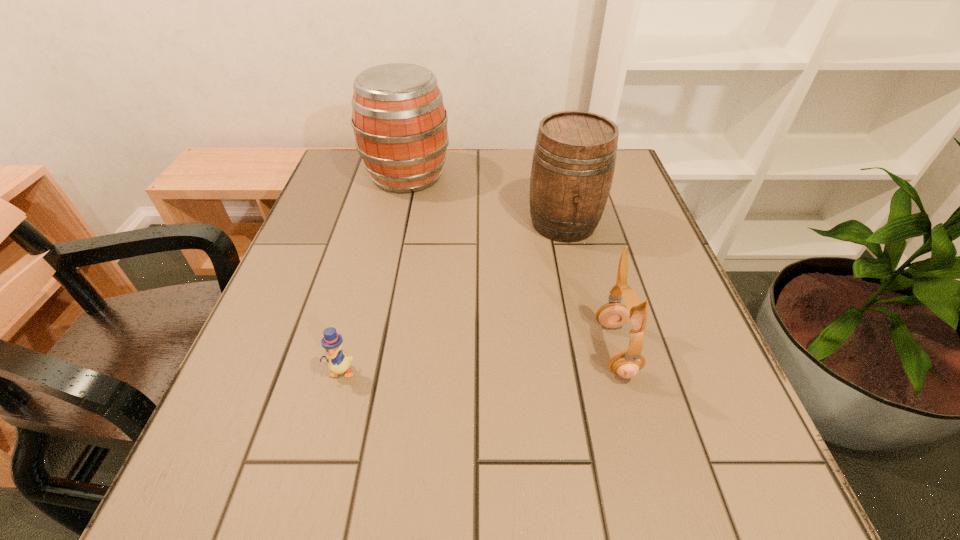
Find the location of a particular element. free point between the nearer cider and the third tallest object is located at coordinates (589, 286).

This screenshot has height=540, width=960. Find the location of `empty space between the second farthest object and the duckling`. empty space between the second farthest object and the duckling is located at coordinates (452, 297).

Find the location of `free space between the left cider and the nearer cider`. free space between the left cider and the nearer cider is located at coordinates (486, 199).

The width and height of the screenshot is (960, 540). Identify the location of vacant area between the second farthest object and the shortest object. (452, 297).

Where is `object that is the second closest one to the second shortest object`? The height and width of the screenshot is (540, 960). object that is the second closest one to the second shortest object is located at coordinates (338, 363).

You are a GUI agent. You are given a task and a screenshot of the screen. Output one action in this format:
    pyautogui.click(x=<x>, y=<y>)
    Task: Click on the object that stands as the second closest to the second shortest object
    The width and height of the screenshot is (960, 540).
    Given the screenshot: What is the action you would take?
    pyautogui.click(x=338, y=363)

Find the location of a particular element. free location that satisfies the following two spatial constraints: 1. on the front-facing side of the earphone; 2. on the face of the duckling, where the monocle is placed is located at coordinates (622, 371).